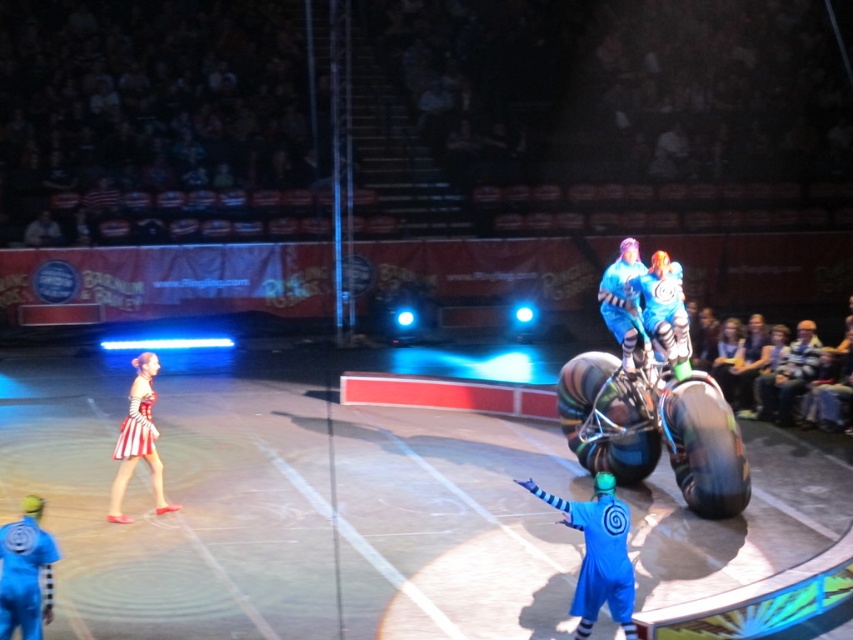
You are a stagehand in the circus arena. You need to move a 20 feet long ladder from the blue metallic motorcycle at upper center to the striped fabric dress at left. Is the space between them sufficient for moving the ladder without bending it?

The distance between the blue metallic motorcycle at upper center and the striped fabric dress at left is 19.87 feet. Since the ladder is 20 feet long, the space is slightly insufficient. You would need to bend the ladder or find a longer path to move it safely.

You are a photographer positioned at the center of the arena. You want to capture a photo of both the mechanical bull and the female performer in the red and white striped dress. Given that the mechanical bull is located at point (x=36, y=545) and the female performer is at point (x=636, y=337), which one should you focus on first to ensure both are in sharp focus?

You should focus on the mechanical bull at point (x=36, y=545) first because it is closer to you than the female performer at point (x=636, y=337). This ensures that both will be in focus when using a camera with a fixed depth of field.